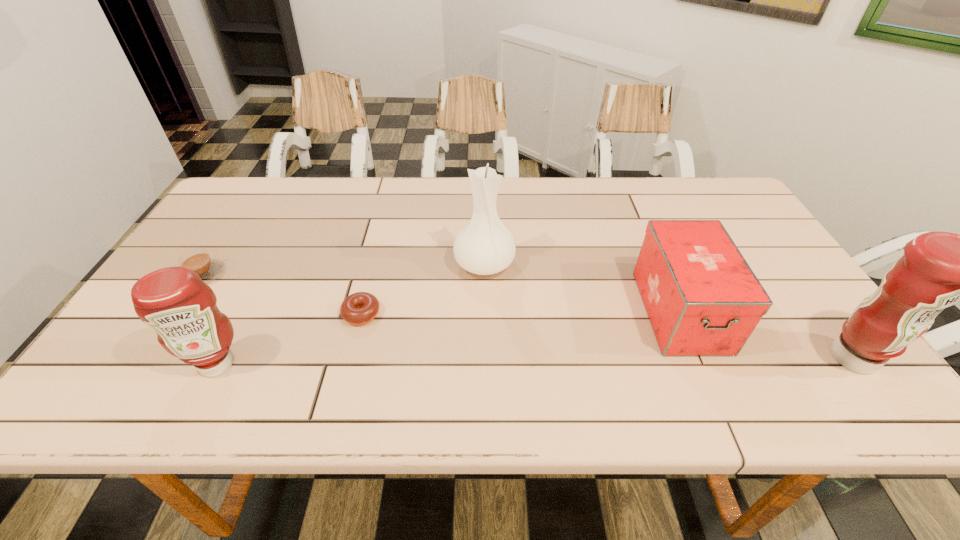
Locate an element on the screen. free space for an extra condiment to achieve even spacing is located at coordinates (538, 361).